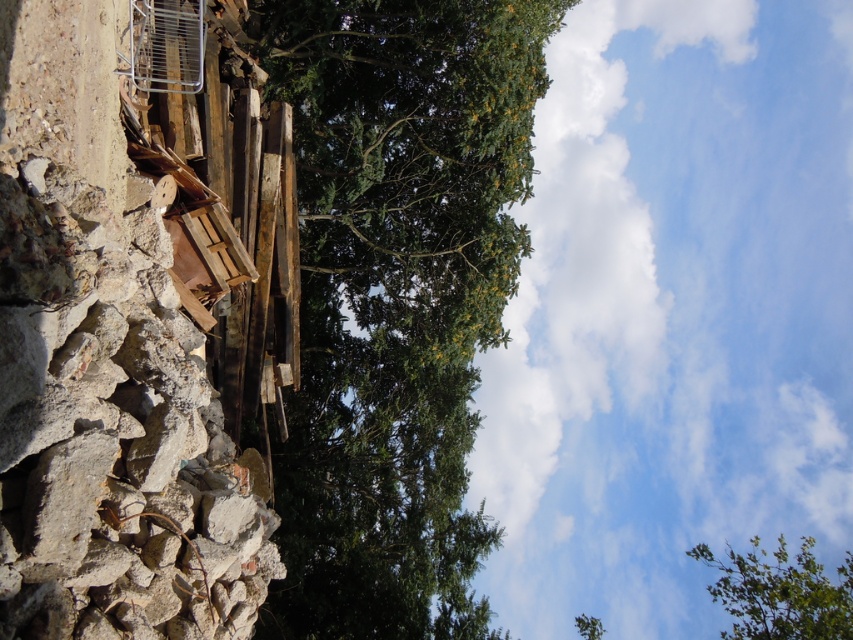
Which of these two, rough concrete cliff at left or green leafy tree at upper center, stands shorter?

With less height is green leafy tree at upper center.

Can you confirm if rough concrete cliff at left is thinner than green leafy tree at upper center?

Yes.

You are a GUI agent. You are given a task and a screenshot of the screen. Output one action in this format:
    pyautogui.click(x=<x>, y=<y>)
    Task: Click on the rough concrete cliff at left
    
    Given the screenshot: What is the action you would take?
    pyautogui.click(x=132, y=321)

Does rough concrete cliff at left appear on the right side of green leafy tree at center?

In fact, rough concrete cliff at left is to the left of green leafy tree at center.

Which is more to the right, rough concrete cliff at left or green leafy tree at center?

From the viewer's perspective, green leafy tree at center appears more on the right side.

Is point (9, 76) positioned after point (277, 468)?

No.

Where is `rough concrete cliff at left`? The height and width of the screenshot is (640, 853). rough concrete cliff at left is located at coordinates (132, 321).

Does point (479, 3) come closer to viewer compared to point (729, 608)?

Yes, it is in front of point (729, 608).

Which is behind, point (332, 292) or point (729, 557)?

The point (729, 557) is more distant.

Who is more forward, (485,308) or (790,579)?

Point (485,308) is more forward.

Identify the location of green leafy tree at center. (396, 298).